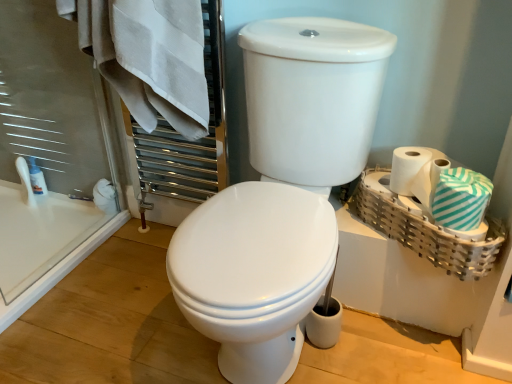
Question: Is white glossy lotion at left positioned with its back to white matte toilet paper at right?

Choices:
 (A) no
 (B) yes

Answer: (A)

Question: Can you confirm if white glossy lotion at left is thinner than white matte toilet paper at right?

Choices:
 (A) yes
 (B) no

Answer: (A)

Question: From a real-world perspective, is white glossy lotion at left on top of white matte toilet paper at right?

Choices:
 (A) no
 (B) yes

Answer: (A)

Question: Can you confirm if white glossy lotion at left is smaller than white matte toilet paper at right?

Choices:
 (A) yes
 (B) no

Answer: (A)

Question: Can white matte toilet paper at right be found inside white glossy lotion at left?

Choices:
 (A) no
 (B) yes

Answer: (A)

Question: Can you confirm if white glossy lotion at left is taller than white matte toilet paper at right?

Choices:
 (A) no
 (B) yes

Answer: (B)

Question: From a real-world perspective, is white glossy toilet at center over teal striped fabric at right, which is counted as the 2th bath towel, starting from the top?

Choices:
 (A) no
 (B) yes

Answer: (A)

Question: Can you confirm if white glossy toilet at center is wider than teal striped fabric at right, which is the first bath towel from bottom to top?

Choices:
 (A) yes
 (B) no

Answer: (A)

Question: Can you confirm if white glossy toilet at center is smaller than teal striped fabric at right, which is the first bath towel from bottom to top?

Choices:
 (A) no
 (B) yes

Answer: (A)

Question: Is white glossy toilet at center taller than teal striped fabric at right, positioned as the second bath towel in left-to-right order?

Choices:
 (A) no
 (B) yes

Answer: (B)

Question: Does white glossy toilet at center contain teal striped fabric at right, which is counted as the 2th bath towel, starting from the top?

Choices:
 (A) yes
 (B) no

Answer: (B)

Question: Does white glossy toilet at center have a lesser height compared to teal striped fabric at right, which is counted as the 2th bath towel, starting from the top?

Choices:
 (A) no
 (B) yes

Answer: (A)

Question: Can you confirm if teal striped fabric at right, positioned as the second bath towel in left-to-right order, is thinner than white matte toilet paper at right?

Choices:
 (A) no
 (B) yes

Answer: (A)